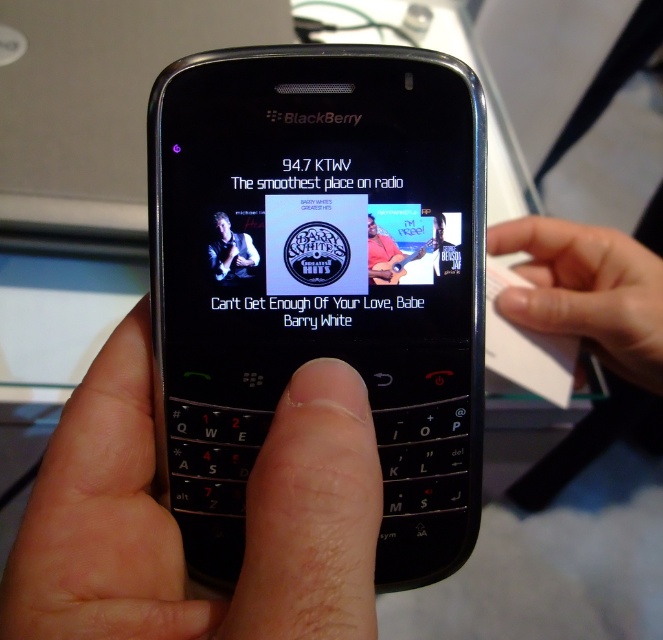
Question: Does skinny white finger at center appear under black leather jacket at upper center?

Choices:
 (A) no
 (B) yes

Answer: (B)

Question: Which point appears closest to the camera in this image?

Choices:
 (A) (123, 353)
 (B) (442, 225)
 (C) (363, 120)
 (D) (638, 330)

Answer: (C)

Question: Which point is closer to the camera?

Choices:
 (A) smooth skin hand at center
 (B) black glossy phone at center

Answer: (B)

Question: Which point is closer to the camera?

Choices:
 (A) (324, 184)
 (B) (139, 616)

Answer: (B)

Question: Does skinny white finger at upper right come in front of smooth skin hand at center?

Choices:
 (A) yes
 (B) no

Answer: (B)

Question: Is skinny white finger at center bigger than skinny white finger at upper right?

Choices:
 (A) no
 (B) yes

Answer: (B)